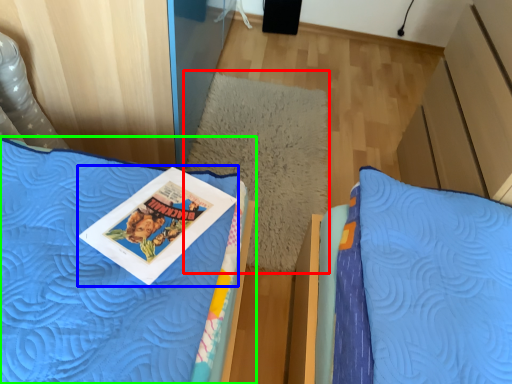
Question: Which is nearer to the pillow (highlighted by a red box)? comic book (highlighted by a blue box) or bed (highlighted by a green box).

Choices:
 (A) comic book
 (B) bed

Answer: (B)